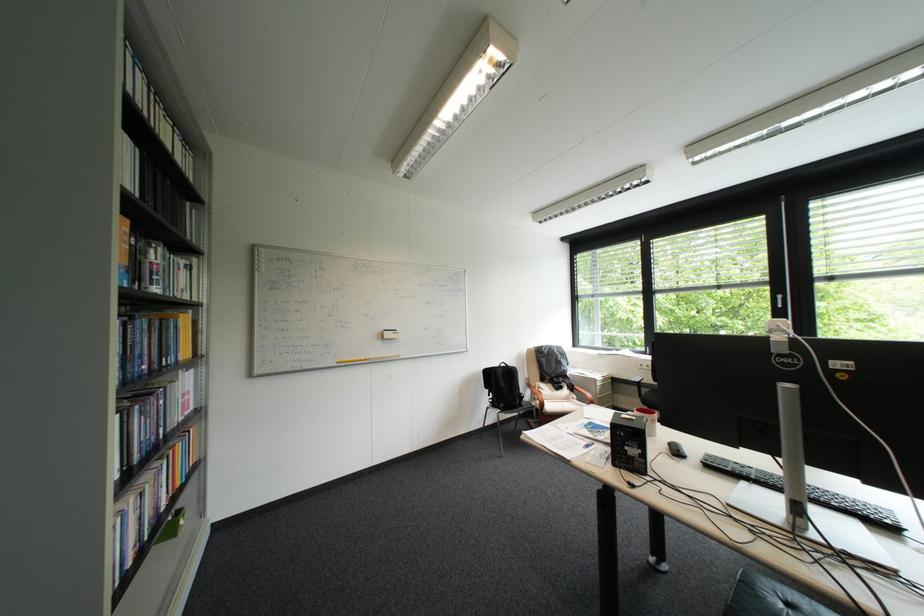
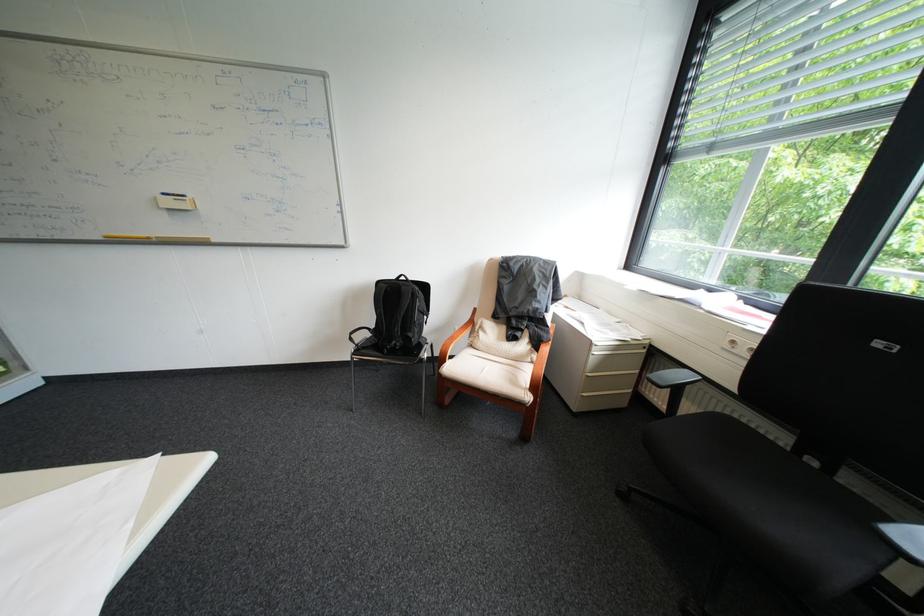
In the second image, find the point that corresponds to [652,366] in the first image.

(746, 342)